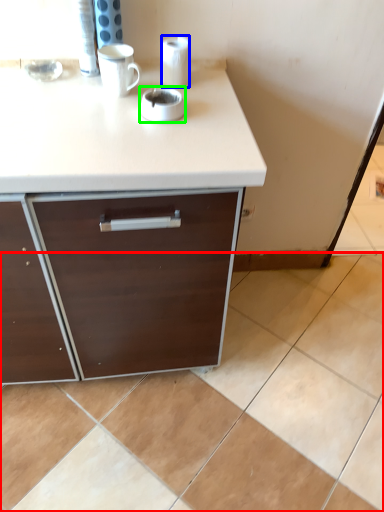
Question: Which is nearer to the ceramic tile (highlighted by a red box)? paper towel (highlighted by a blue box) or appliance (highlighted by a green box).

Choices:
 (A) paper towel
 (B) appliance

Answer: (B)